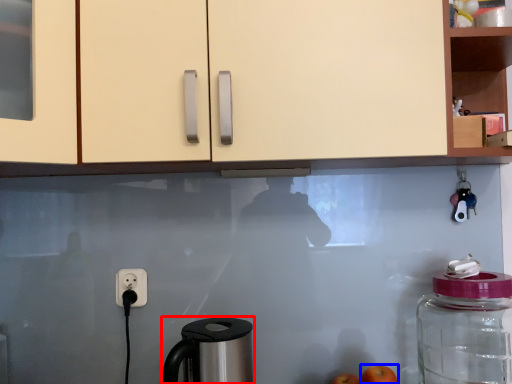
Question: Which of the following is the farthest to the observer, coffee maker (highlighted by a red box) or apple (highlighted by a blue box)?

Choices:
 (A) coffee maker
 (B) apple

Answer: (B)